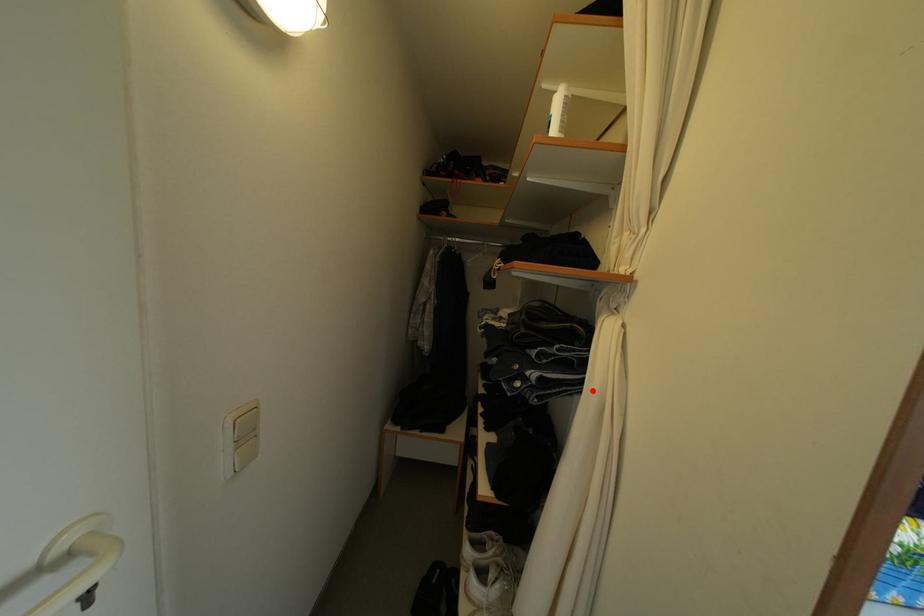
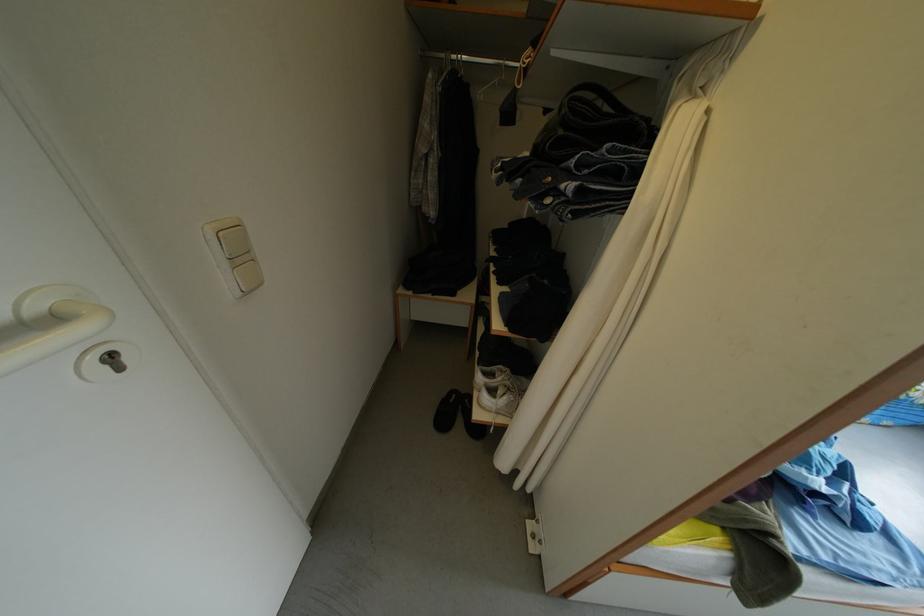
The point at the highlighted location is marked in the first image. Where is the corresponding point in the second image?

(639, 204)